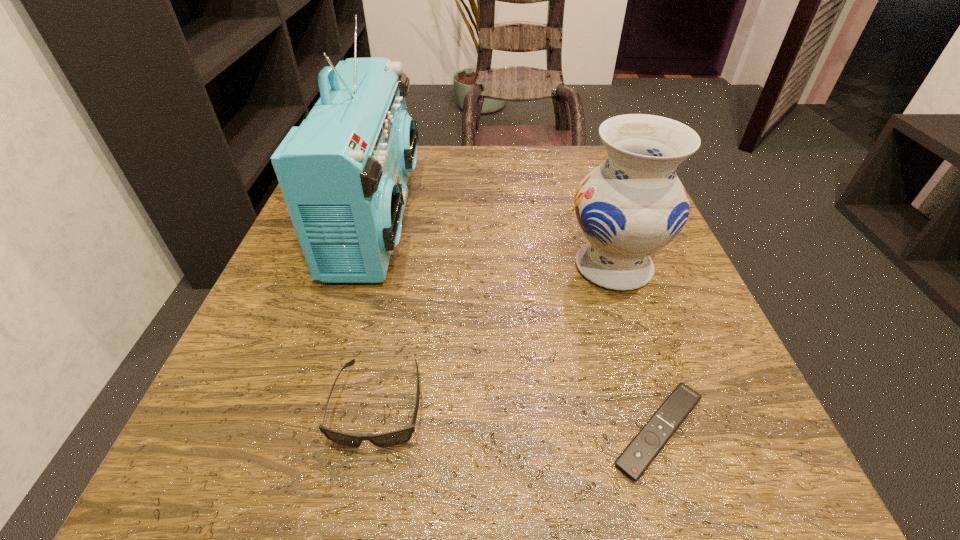
In the image, there is a desktop. Where is `vacant space at the far right corner`? The height and width of the screenshot is (540, 960). vacant space at the far right corner is located at coordinates (601, 163).

The image size is (960, 540). Find the location of `vacant space at the near right corner of the desktop`. vacant space at the near right corner of the desktop is located at coordinates (695, 516).

What are the coordinates of `free area in between the radio receiver and the remote control` in the screenshot? It's located at (517, 325).

The height and width of the screenshot is (540, 960). In order to click on free space between the sunglasses and the vase in this screenshot , I will do `click(496, 335)`.

The width and height of the screenshot is (960, 540). Identify the location of vacant space that's between the third shortest object and the sunglasses. (496, 335).

The height and width of the screenshot is (540, 960). Find the location of `free space that is in between the third shortest object and the third tallest object`. free space that is in between the third shortest object and the third tallest object is located at coordinates (496, 335).

The width and height of the screenshot is (960, 540). What are the coordinates of `free space that is in between the shortest object and the third tallest object` in the screenshot? It's located at (518, 417).

I want to click on empty space that is in between the third shortest object and the sunglasses, so click(x=496, y=335).

Find the location of a particular element. Image resolution: width=960 pixels, height=540 pixels. free space between the radio receiver and the third shortest object is located at coordinates (495, 242).

This screenshot has height=540, width=960. In order to click on free space between the radio receiver and the second shortest object in this screenshot , I will do tap(377, 310).